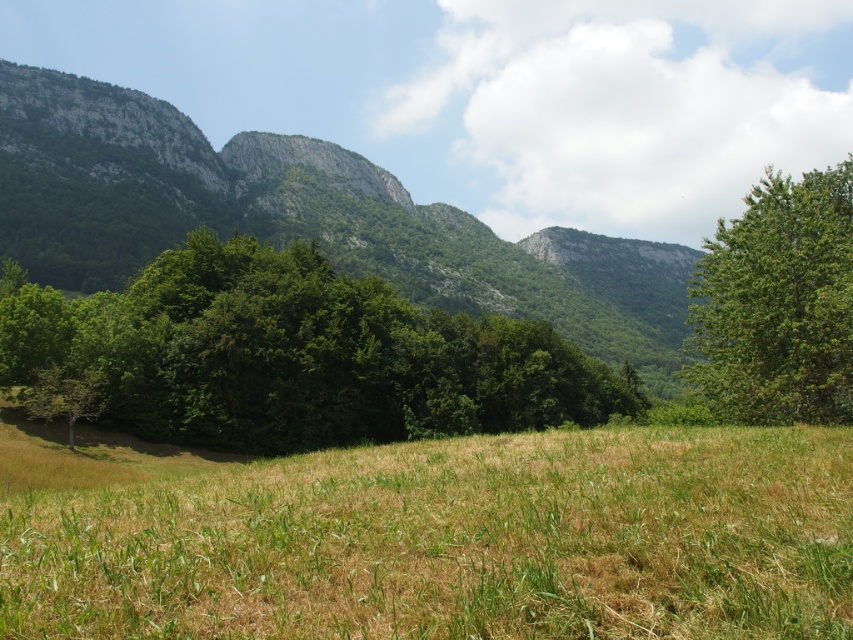
Question: Which of the following is the closest to the observer?

Choices:
 (A) brown dry grass at lower center
 (B) green leafy tree at center
 (C) green rock mountain at center
 (D) green leafy tree at right

Answer: (A)

Question: Is brown dry grass at lower center to the right of green leafy tree at right from the viewer's perspective?

Choices:
 (A) yes
 (B) no

Answer: (B)

Question: Considering the relative positions of green leafy tree at center and green rock mountain at center in the image provided, where is green leafy tree at center located with respect to green rock mountain at center?

Choices:
 (A) above
 (B) below

Answer: (B)

Question: Which point is closer to the camera taking this photo?

Choices:
 (A) (544, 275)
 (B) (837, 305)
 (C) (264, 337)

Answer: (B)

Question: Is green rock mountain at center to the right of green leafy tree at right from the viewer's perspective?

Choices:
 (A) no
 (B) yes

Answer: (B)

Question: Among these points, which one is nearest to the camera?

Choices:
 (A) (813, 196)
 (B) (648, 282)
 (C) (717, 598)

Answer: (C)